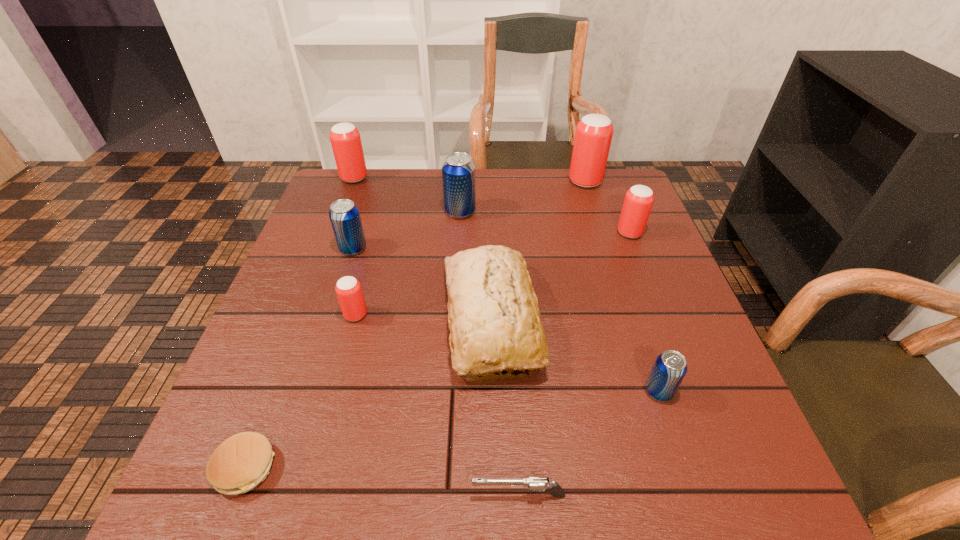
Find the location of a particular element. The image size is (960, 540). the smallest blue beer can is located at coordinates (670, 367).

Locate an element on the screen. the third red beer can from right to left is located at coordinates (348, 289).

This screenshot has height=540, width=960. I want to click on the nearest red beer can, so click(348, 289).

This screenshot has width=960, height=540. I want to click on silver pistol, so click(539, 484).

The image size is (960, 540). In order to click on pistol in this screenshot , I will do 539,484.

Where is `patty`? The image size is (960, 540). patty is located at coordinates (241, 462).

The image size is (960, 540). I want to click on free space located 0.330m on the front of the tallest beer can, so click(x=612, y=266).

Where is `free point located 0.100m on the right of the second biggest red beer can`? The image size is (960, 540). free point located 0.100m on the right of the second biggest red beer can is located at coordinates (400, 178).

Identify the location of free space located 0.130m on the front of the fifth nearest beer can. (458, 252).

I want to click on vacant position located on the front of the second nearest red beer can, so click(x=641, y=262).